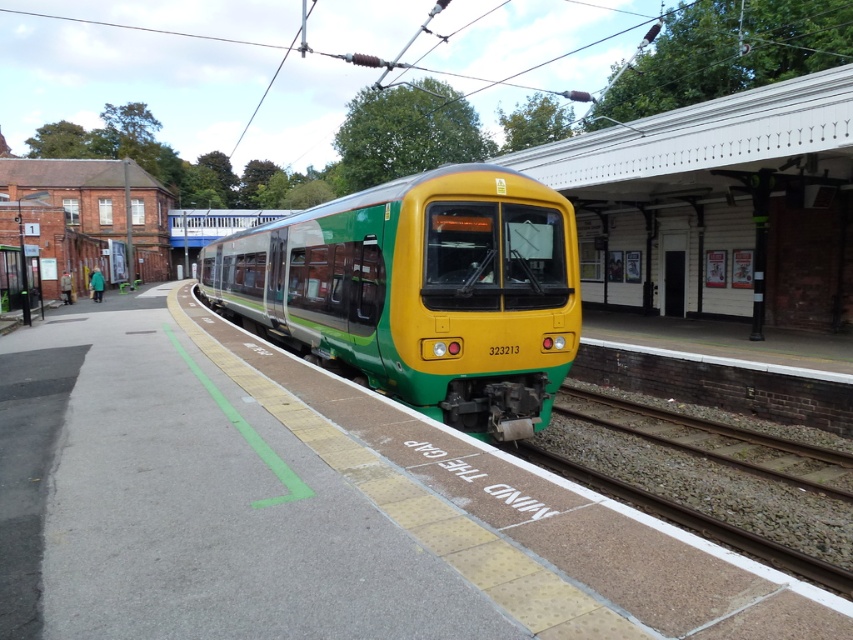
Question: Among these points, which one is farthest from the camera?

Choices:
 (A) (727, 544)
 (B) (421, 202)

Answer: (B)

Question: Considering the relative positions of green matte train at center and green gravel train track at lower center in the image provided, where is green matte train at center located with respect to green gravel train track at lower center?

Choices:
 (A) left
 (B) right

Answer: (A)

Question: Which object is farther from the camera taking this photo?

Choices:
 (A) green matte train at center
 (B) green gravel train track at lower center

Answer: (A)

Question: Does green matte train at center have a larger size compared to green gravel train track at lower center?

Choices:
 (A) no
 (B) yes

Answer: (B)

Question: Does green matte train at center have a smaller size compared to green gravel train track at lower center?

Choices:
 (A) no
 (B) yes

Answer: (A)